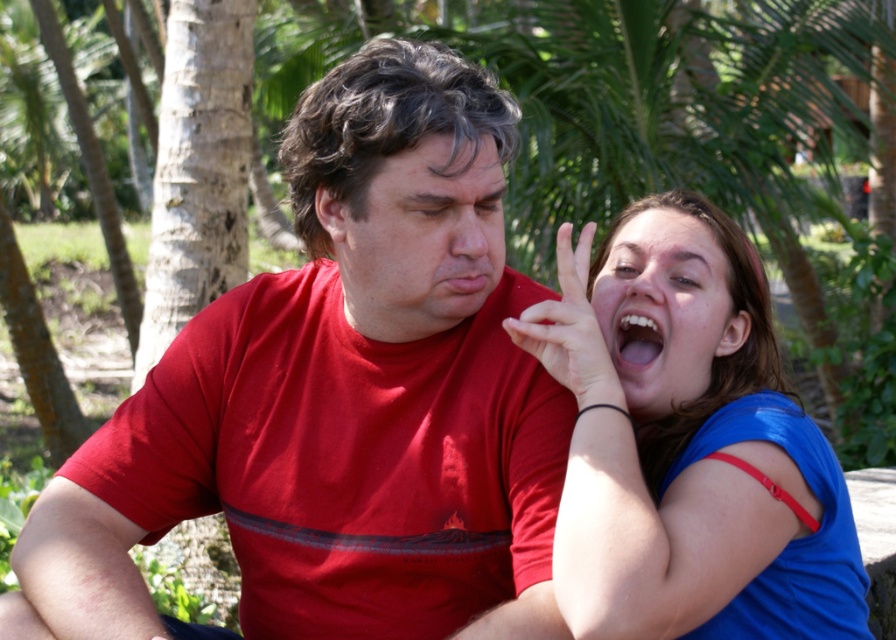
You are standing at the origin point in the image. Which of the two points, point (452, 280) or point (795, 616), is farther away from you?

Point (452, 280) is behind point (795, 616), so it is farther away from you.